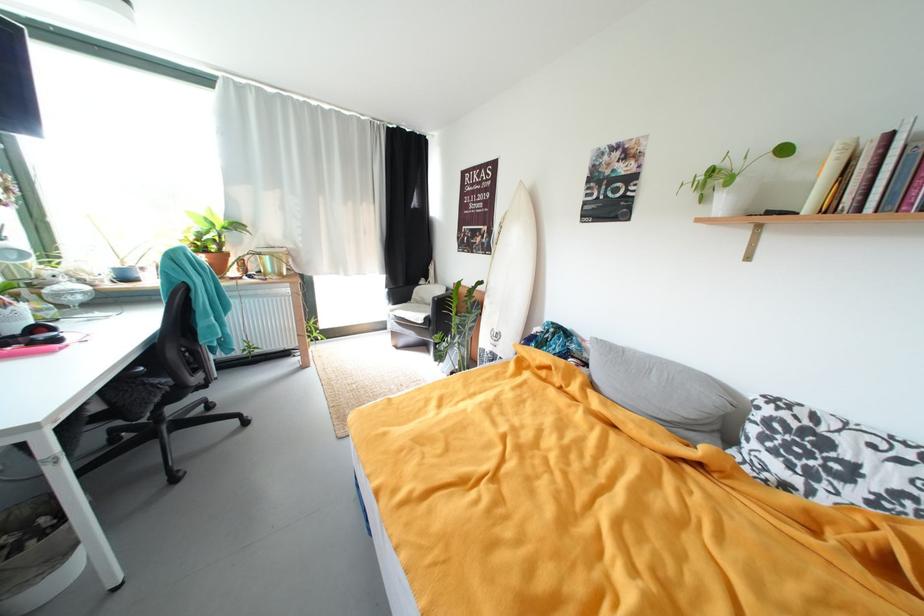
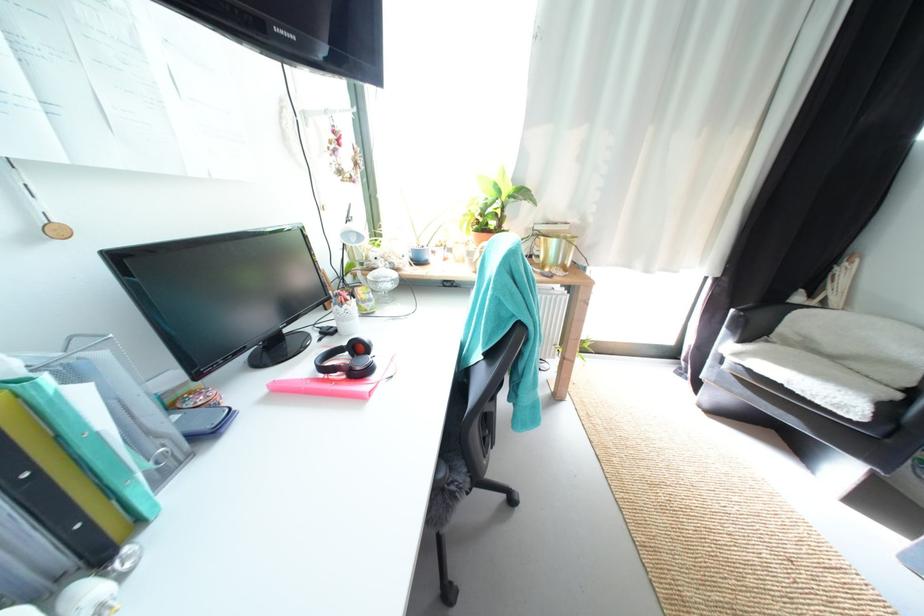
Find the pixel in the second image that matches [274,261] in the first image.

(562, 244)